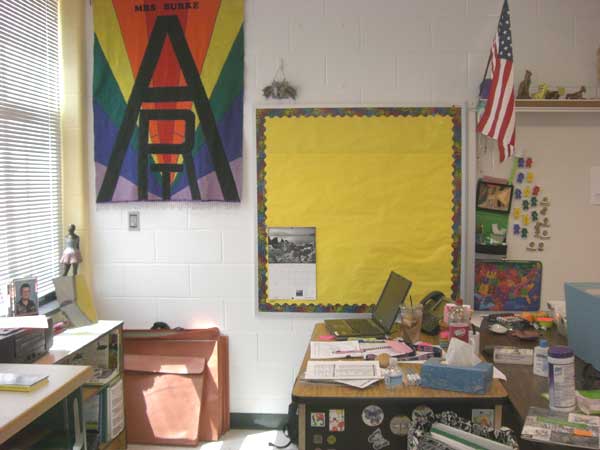
Where is `drapes`? Image resolution: width=600 pixels, height=450 pixels. drapes is located at coordinates (77, 156).